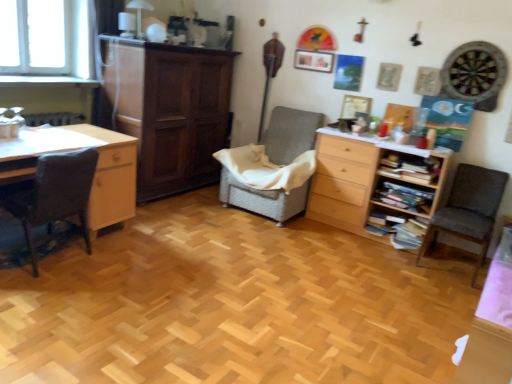
Where is `dark brown wood cabinet at center`? dark brown wood cabinet at center is located at coordinates (168, 110).

What do you see at coordinates (403, 196) in the screenshot?
I see `wooden bookshelf at right, which is the 2th shelf in top-to-bottom order` at bounding box center [403, 196].

Image resolution: width=512 pixels, height=384 pixels. What do you see at coordinates (53, 195) in the screenshot? I see `dark gray fabric chair at left, the third chair from the right` at bounding box center [53, 195].

At what (x,y) coordinates should I click in order to perform the action: click on woven fabric chair at center, positioned as the second chair in right-to-left order. Please return your answer as a coordinate pair (x, y). Image resolution: width=512 pixels, height=384 pixels. Looking at the image, I should click on (262, 198).

Based on the photo, would you consider wooden bookshelf at right, acting as the 1th shelf starting from the top, to be distant from woven fabric chair at center, positioned as the second chair in right-to-left order?

No, wooden bookshelf at right, acting as the 1th shelf starting from the top, is in close proximity to woven fabric chair at center, positioned as the second chair in right-to-left order.

Consider the image. From the image's perspective, is wooden bookshelf at right, acting as the 1th shelf starting from the top, beneath woven fabric chair at center, positioned as the second chair in right-to-left order?

Indeed, from the image's perspective, wooden bookshelf at right, acting as the 1th shelf starting from the top, is shown beneath woven fabric chair at center, positioned as the second chair in right-to-left order.

How different are the orientations of wooden bookshelf at right, acting as the 1th shelf starting from the top, and woven fabric chair at center, positioned as the second chair in right-to-left order, in degrees?

The facing directions of wooden bookshelf at right, acting as the 1th shelf starting from the top, and woven fabric chair at center, positioned as the second chair in right-to-left order, are 0.66 degrees apart.

Who is taller, wooden bookshelf at right, which appears as the 2th shelf when ordered from the bottom, or woven fabric chair at center, positioned as the second chair in right-to-left order?

With more height is woven fabric chair at center, positioned as the second chair in right-to-left order.

From a real-world perspective, who is located higher, woven fabric chair at center, arranged as the 2th chair when viewed from the left, or wooden bookshelf at right, acting as the 1th shelf starting from the top?

wooden bookshelf at right, acting as the 1th shelf starting from the top, from a real-world perspective.

Who is smaller, woven fabric chair at center, positioned as the second chair in right-to-left order, or wooden bookshelf at right, which appears as the 2th shelf when ordered from the bottom?

wooden bookshelf at right, which appears as the 2th shelf when ordered from the bottom.

From the image's perspective, would you say woven fabric chair at center, positioned as the second chair in right-to-left order, is positioned over wooden bookshelf at right, which appears as the 2th shelf when ordered from the bottom?

Yes.

Can you tell me how much woven fabric chair at center, arranged as the 2th chair when viewed from the left, and wooden bookshelf at right, acting as the 1th shelf starting from the top, differ in facing direction?

They differ by 0.66 degrees in their facing directions.

Which is closer to the camera, (131, 195) or (198, 173)?

The point (131, 195) is in front.

From the picture: Measure the distance from light wood desk at left to dark brown wood cabinet at center.

A distance of 31.86 inches exists between light wood desk at left and dark brown wood cabinet at center.

From the image's perspective, which one is positioned lower, light wood desk at left or dark brown wood cabinet at center?

light wood desk at left.

Is light wood desk at left oriented towards dark brown wood cabinet at center?

No, light wood desk at left does not turn towards dark brown wood cabinet at center.

Is woven fabric chair at center, arranged as the 2th chair when viewed from the left, inside light wood desk at left?

No, woven fabric chair at center, arranged as the 2th chair when viewed from the left, is not surrounded by light wood desk at left.

From the image's perspective, which one is positioned higher, light wood desk at left or woven fabric chair at center, positioned as the second chair in right-to-left order?

woven fabric chair at center, positioned as the second chair in right-to-left order, from the image's perspective.

Which is behind, point (97, 162) or point (279, 116)?

The point (279, 116) is more distant.

Does light wood desk at left have a greater height compared to woven fabric chair at center, arranged as the 2th chair when viewed from the left?

Incorrect, the height of light wood desk at left is not larger of that of woven fabric chair at center, arranged as the 2th chair when viewed from the left.

Measure the distance between dark gray fabric chair at left, the third chair from the right, and dark brown wood cabinet at center.

The distance of dark gray fabric chair at left, the third chair from the right, from dark brown wood cabinet at center is 1.31 meters.

How many degrees apart are the facing directions of dark gray fabric chair at left, the third chair from the right, and dark brown wood cabinet at center?

They differ by 179 degrees in their facing directions.

Can you confirm if dark gray fabric chair at left, the first chair from the left, is positioned to the left of dark brown wood cabinet at center?

Indeed, dark gray fabric chair at left, the first chair from the left, is positioned on the left side of dark brown wood cabinet at center.

Is the surface of dark gray fabric chair at left, the third chair from the right, in direct contact with dark brown wood cabinet at center?

dark gray fabric chair at left, the third chair from the right, and dark brown wood cabinet at center are clearly separated.

Is wooden bookshelf at right, acting as the 1th shelf starting from the top, not near light wood desk at left?

wooden bookshelf at right, acting as the 1th shelf starting from the top, is positioned a significant distance from light wood desk at left.

Is wooden bookshelf at right, which appears as the 2th shelf when ordered from the bottom, bigger than light wood desk at left?

No, wooden bookshelf at right, which appears as the 2th shelf when ordered from the bottom, is not bigger than light wood desk at left.

Is wooden bookshelf at right, acting as the 1th shelf starting from the top, positioned behind light wood desk at left?

Yes, wooden bookshelf at right, acting as the 1th shelf starting from the top, is further from the camera.

How much distance is there between wooden bookshelf at right, which appears as the 2th shelf when ordered from the bottom, and light wood desk at left?

2.30 meters.

Based on their sizes in the image, would you say dark gray fabric chair at right, which appears as the third chair when viewed from the left, is bigger or smaller than dark brown wood cabinet at center?

dark gray fabric chair at right, which appears as the third chair when viewed from the left, is smaller than dark brown wood cabinet at center.

Which is in front, dark gray fabric chair at right, the first chair from the right, or dark brown wood cabinet at center?

dark gray fabric chair at right, the first chair from the right, is more forward.

Considering the positions of objects dark gray fabric chair at right, the first chair from the right, and dark brown wood cabinet at center in the image provided, who is more to the left, dark gray fabric chair at right, the first chair from the right, or dark brown wood cabinet at center?

Positioned to the left is dark brown wood cabinet at center.

At what (x,y) coordinates should I click in order to perform the action: click on chair that is the 2nd one when counting forward from the dark brown wood cabinet at center. Please return your answer as a coordinate pair (x, y). Looking at the image, I should click on (468, 210).

Where is `shelf above the woven fabric chair at center, arranged as the 2th chair when viewed from the left (from a real-world perspective)`? This screenshot has width=512, height=384. shelf above the woven fabric chair at center, arranged as the 2th chair when viewed from the left (from a real-world perspective) is located at coordinates (411, 167).

This screenshot has height=384, width=512. I want to click on shelf that is the 1st object located below the woven fabric chair at center, positioned as the second chair in right-to-left order (from the image's perspective), so click(411, 167).

From the image, which object appears to be nearer to light wood chest of drawers at center right, wooden bookshelf at right, which is the 1th shelf in bottom-to-top order, or dark gray fabric chair at right, which appears as the third chair when viewed from the left?

Among the two, wooden bookshelf at right, which is the 1th shelf in bottom-to-top order, is located nearer to light wood chest of drawers at center right.

Estimate the real-world distances between objects in this image. Which object is further from woven fabric chair at center, positioned as the second chair in right-to-left order, wooden bookshelf at right, which is the 2th shelf in top-to-bottom order, or wooden bookshelf at right, acting as the 1th shelf starting from the top?

Based on the image, wooden bookshelf at right, acting as the 1th shelf starting from the top, appears to be further to woven fabric chair at center, positioned as the second chair in right-to-left order.

Looking at the image, which one is located further to wooden bookshelf at right, which appears as the 2th shelf when ordered from the bottom, dark gray fabric chair at right, the first chair from the right, or dark brown wood cabinet at center?

Based on the image, dark brown wood cabinet at center appears to be further to wooden bookshelf at right, which appears as the 2th shelf when ordered from the bottom.

Looking at this image, when comparing their distances from light wood chest of drawers at center right, does light wood desk at left or dark gray fabric chair at left, the first chair from the left, seem further?

dark gray fabric chair at left, the first chair from the left, lies further to light wood chest of drawers at center right than the other object.

Based on their spatial positions, is light wood chest of drawers at center right or dark gray fabric chair at left, the first chair from the left, closer to wooden bookshelf at right, which is the 2th shelf in top-to-bottom order?

Based on the image, light wood chest of drawers at center right appears to be nearer to wooden bookshelf at right, which is the 2th shelf in top-to-bottom order.

Which object lies nearer to the anchor point dark gray fabric chair at right, which appears as the third chair when viewed from the left, light wood chest of drawers at center right or dark brown wood cabinet at center?

light wood chest of drawers at center right lies closer to dark gray fabric chair at right, which appears as the third chair when viewed from the left, than the other object.

Based on their spatial positions, is dark gray fabric chair at left, the third chair from the right, or wooden bookshelf at right, which is the 1th shelf in bottom-to-top order, closer to dark gray fabric chair at right, which appears as the third chair when viewed from the left?

Among the two, wooden bookshelf at right, which is the 1th shelf in bottom-to-top order, is located nearer to dark gray fabric chair at right, which appears as the third chair when viewed from the left.

Based on their spatial positions, is dark gray fabric chair at right, which appears as the third chair when viewed from the left, or light wood desk at left closer to dark brown wood cabinet at center?

Based on the image, light wood desk at left appears to be nearer to dark brown wood cabinet at center.

Locate an element on the screen. chair between dark gray fabric chair at left, the first chair from the left, and wooden bookshelf at right, which appears as the 2th shelf when ordered from the bottom, in the horizontal direction is located at coordinates (262, 198).

Find the location of a particular element. The width and height of the screenshot is (512, 384). shelf located between light wood desk at left and wooden bookshelf at right, acting as the 1th shelf starting from the top, in the left-right direction is located at coordinates (403, 196).

Find the location of a particular element. The image size is (512, 384). desk located between dark gray fabric chair at left, the third chair from the right, and dark brown wood cabinet at center in the depth direction is located at coordinates (96, 167).

The height and width of the screenshot is (384, 512). I want to click on the chest of drawers situated between woven fabric chair at center, arranged as the 2th chair when viewed from the left, and dark gray fabric chair at right, which appears as the third chair when viewed from the left, from left to right, so click(366, 183).